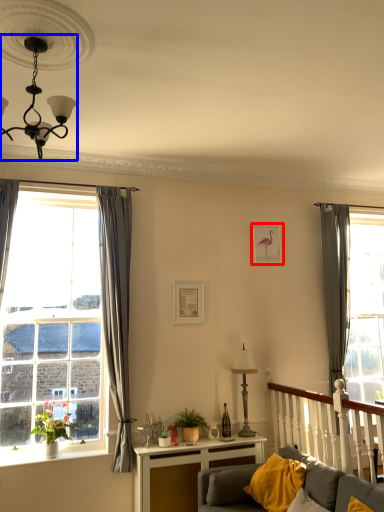
Question: Which object is further to the camera taking this photo, picture frame (highlighted by a red box) or light fixture (highlighted by a blue box)?

Choices:
 (A) picture frame
 (B) light fixture

Answer: (A)